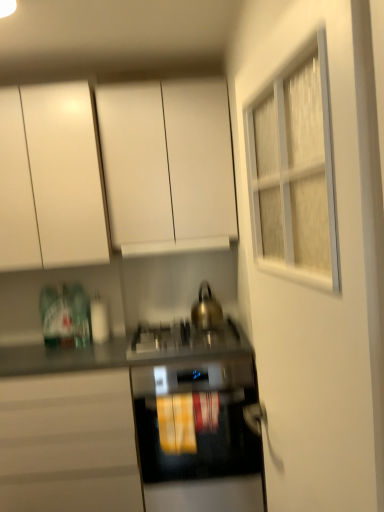
Question: Visually, is matte white cabinet at lower left, which appears as the first cabinetry when ordered from the bottom, positioned to the left or to the right of gold metallic kettle at center?

Choices:
 (A) left
 (B) right

Answer: (A)

Question: In terms of width, does matte white cabinet at lower left, the third cabinetry positioned from the top, look wider or thinner when compared to gold metallic kettle at center?

Choices:
 (A) thin
 (B) wide

Answer: (B)

Question: Which is nearer to the green glass bottle at left, which is the 1th bottle from right to left?

Choices:
 (A) white glass door at upper right
 (B) white matte cabinet at upper center, placed as the third cabinetry when sorted from bottom to top
 (C) translucent green bottle at left, placed as the 1th bottle when sorted from left to right
 (D) matte white cabinet at lower left, which appears as the first cabinetry when ordered from the bottom
 (E) white matte cabinet at upper left, the 2th cabinetry in the top-to-bottom sequence

Answer: (C)

Question: Which object is the farthest from the black glass oven at center?

Choices:
 (A) gold metallic kettle at center
 (B) white matte cabinet at upper left, the 2th cabinetry in the top-to-bottom sequence
 (C) white matte exhaust hood at center
 (D) green glass bottle at left, which is the 1th bottle from right to left
 (E) matte white cabinet at lower left, which appears as the first cabinetry when ordered from the bottom

Answer: (B)